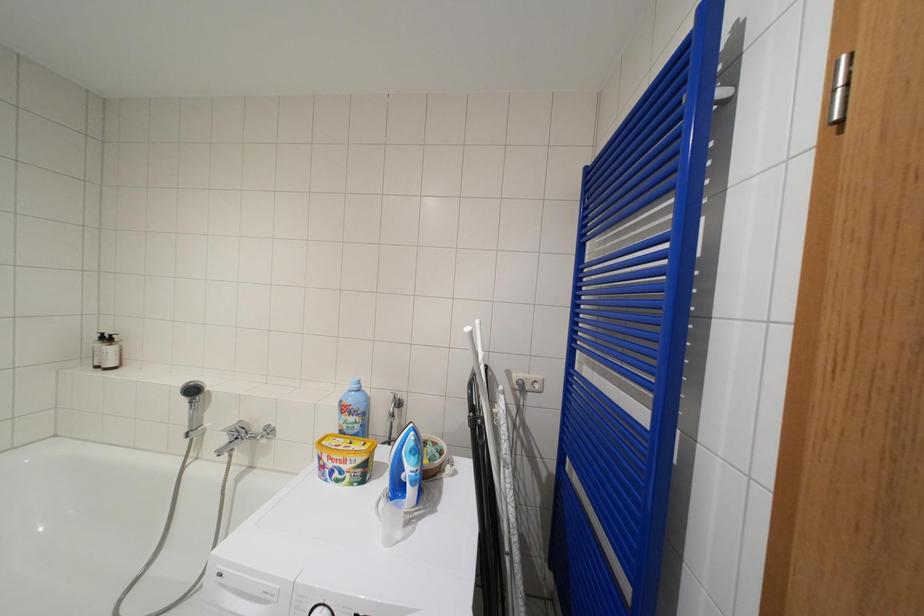
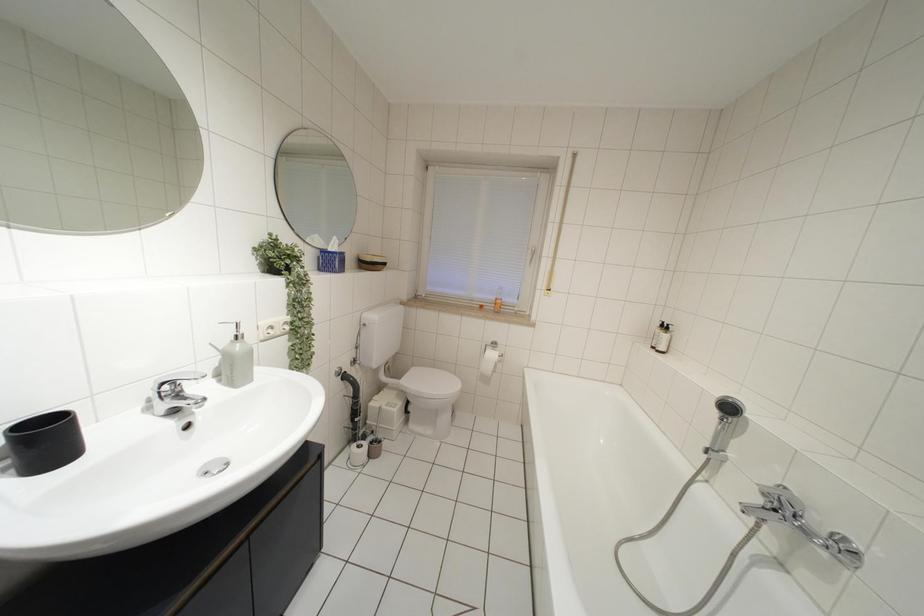
Question: The images are taken continuously from a first-person perspective. In which direction is your viewpoint rotating?

Choices:
 (A) Left
 (B) Right
 (C) Up
 (D) Down

Answer: (A)